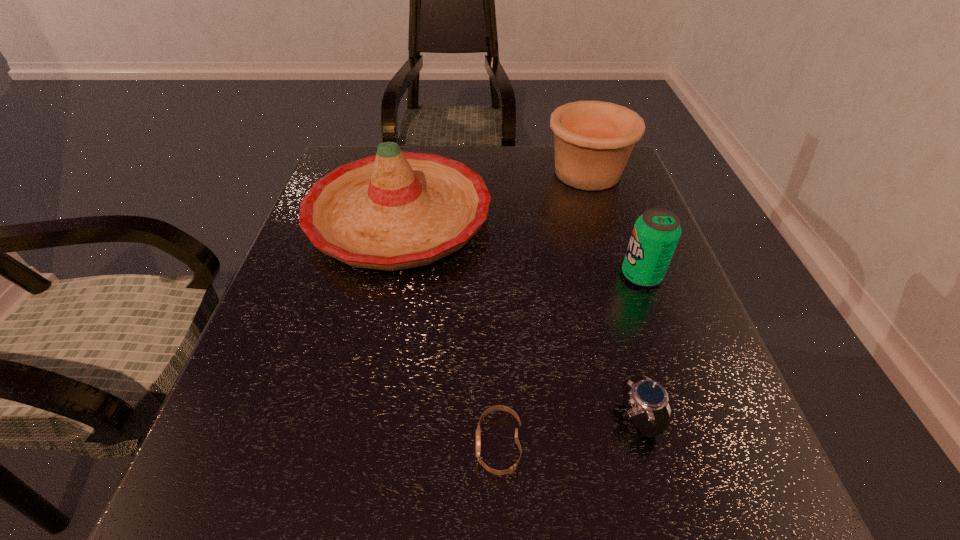
You are a GUI agent. You are given a task and a screenshot of the screen. Output one action in this format:
    pyautogui.click(x=<x>, y=<y>)
    Task: Click on the free region located 0.230m on the front-facing side of the pop soda
    This screenshot has height=540, width=960.
    Given the screenshot: What is the action you would take?
    pyautogui.click(x=514, y=275)

Find the location of a particular element. free space located 0.230m on the front-facing side of the pop soda is located at coordinates click(514, 275).

Image resolution: width=960 pixels, height=540 pixels. What are the coordinates of `free spot located on the left of the taller watch` in the screenshot? It's located at (433, 418).

Identify the location of vacant space located 0.160m on the face of the shortest object. The height and width of the screenshot is (540, 960). (372, 444).

Image resolution: width=960 pixels, height=540 pixels. Find the location of `vacant space located on the face of the shortest object`. vacant space located on the face of the shortest object is located at coordinates (352, 444).

Find the location of a particular element. free space located on the face of the shortest object is located at coordinates (255, 444).

Image resolution: width=960 pixels, height=540 pixels. I want to click on sombrero that is at the far edge, so click(x=395, y=210).

This screenshot has width=960, height=540. Identify the location of pottery present at the far edge. (593, 140).

Where is `object that is at the near edge`? Image resolution: width=960 pixels, height=540 pixels. object that is at the near edge is located at coordinates (478, 431).

The image size is (960, 540). In order to click on object at the left edge in this screenshot , I will do `click(395, 210)`.